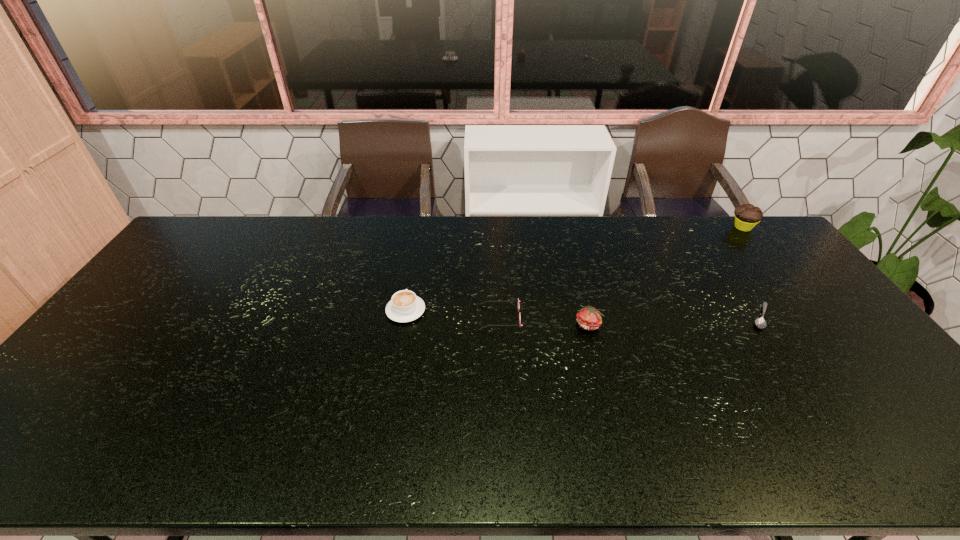
This screenshot has width=960, height=540. Find the location of `vacant space that satisfies the following two spatial constraints: 1. on the back side of the tallest object; 2. on the left side of the second tallest object`. vacant space that satisfies the following two spatial constraints: 1. on the back side of the tallest object; 2. on the left side of the second tallest object is located at coordinates (564, 227).